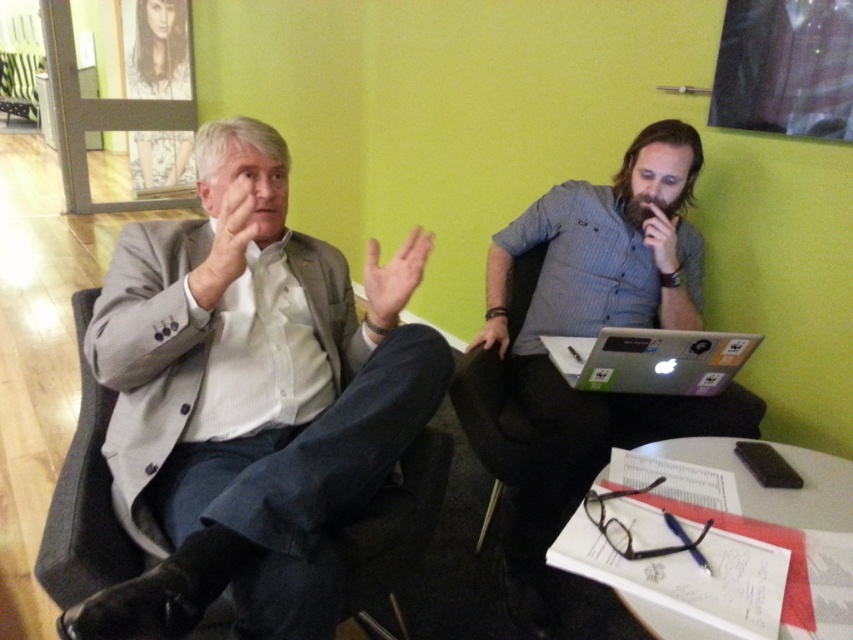
Between point (189, 605) and point (704, 353), which one is positioned behind?

The point (704, 353) is behind.

Is light gray suit at left positioned at the back of silver metallic laptop at center right?

No, it is not.

The height and width of the screenshot is (640, 853). Find the location of `light gray suit at left`. light gray suit at left is located at coordinates (248, 401).

Is light gray suit at left bigger than matte gray shirt at center?

Yes.

Which is behind, point (148, 376) or point (660, 289)?

The point (660, 289) is behind.

Where is `light gray suit at left`? This screenshot has height=640, width=853. light gray suit at left is located at coordinates (248, 401).

From the picture: Is matte gray shirt at center behind silver metallic laptop at center right?

Yes.

Is matte gray shirt at center positioned before silver metallic laptop at center right?

No, it is not.

You are a GUI agent. You are given a task and a screenshot of the screen. Output one action in this format:
    pyautogui.click(x=<x>, y=<y>)
    Task: Click on the matte gray shirt at center
    The width and height of the screenshot is (853, 640).
    Given the screenshot: What is the action you would take?
    pyautogui.click(x=595, y=333)

Locate an element on the screen. The width and height of the screenshot is (853, 640). matte gray shirt at center is located at coordinates (595, 333).